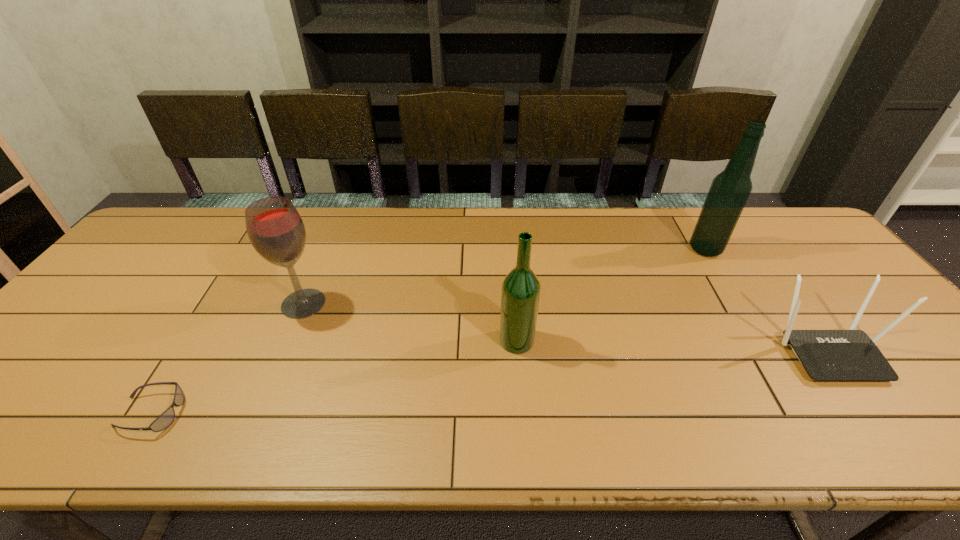
The height and width of the screenshot is (540, 960). In the image, there is a desktop. Identify the location of vacant space at the right edge. (858, 299).

The height and width of the screenshot is (540, 960). Identify the location of vacant space at the far right corner of the desktop. (793, 226).

Identify the location of free space between the second shortest object and the leftmost object. The image size is (960, 540). (490, 382).

Locate an element on the screen. This screenshot has width=960, height=540. vacant space that is in between the leftmost alcohol and the nearest alcohol is located at coordinates (410, 322).

I want to click on vacant area that lies between the router and the second object from left to right, so click(565, 327).

Image resolution: width=960 pixels, height=540 pixels. I want to click on empty location between the fourth tallest object and the farthest object, so click(766, 300).

I want to click on vacant point located between the second object from left to right and the sunglasses, so click(x=227, y=358).

This screenshot has width=960, height=540. What are the coordinates of `unoccupied area between the sunglasses and the leftmost alcohol` in the screenshot? It's located at (227, 358).

Find the location of a particular element. The image size is (960, 540). vacant area that lies between the second farthest object and the nearest alcohol is located at coordinates (410, 322).

You are a GUI agent. You are given a task and a screenshot of the screen. Output one action in this format:
    pyautogui.click(x=<x>, y=<y>)
    Task: Click on the vacant region between the farthest alcohol and the shortest object
    Image resolution: width=960 pixels, height=540 pixels.
    Given the screenshot: What is the action you would take?
    pyautogui.click(x=428, y=331)